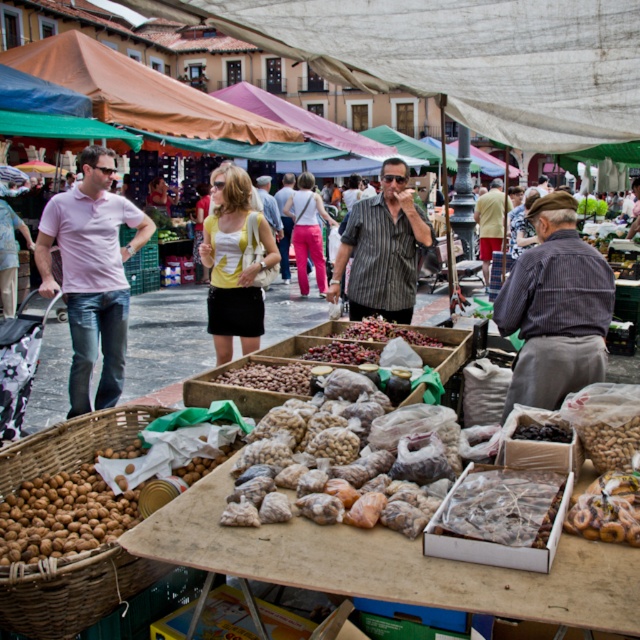
Can you confirm if translucent plastic bags at center is taller than brown woven basket at lower left?

Correct, translucent plastic bags at center is much taller as brown woven basket at lower left.

Is point (300, 506) farther from camera compared to point (65, 573)?

Yes, point (300, 506) is behind point (65, 573).

Find the location of `translucent plastic bags at center`. translucent plastic bags at center is located at coordinates (358, 460).

You are a GUI agent. You are given a task and a screenshot of the screen. Output one action in this format:
    pyautogui.click(x=<x>, y=<y>)
    Task: Click on the translucent plastic bags at center
    Image resolution: width=640 pixels, height=640 pixels.
    Given the screenshot: What is the action you would take?
    pyautogui.click(x=358, y=460)

Who is more distant from viewer, (412,465) or (116,328)?

A: The point (116,328) is behind.

The image size is (640, 640). Identify the location of translucent plastic bags at center. (358, 460).

Which is below, yellow striped shirt at center or brown woven basket at center?

brown woven basket at center

Looking at this image, who is more forward, (x=483, y=237) or (x=122, y=225)?

Point (x=122, y=225) is more forward.

The height and width of the screenshot is (640, 640). What are the coordinates of `yellow striped shirt at center` in the screenshot? It's located at (490, 221).